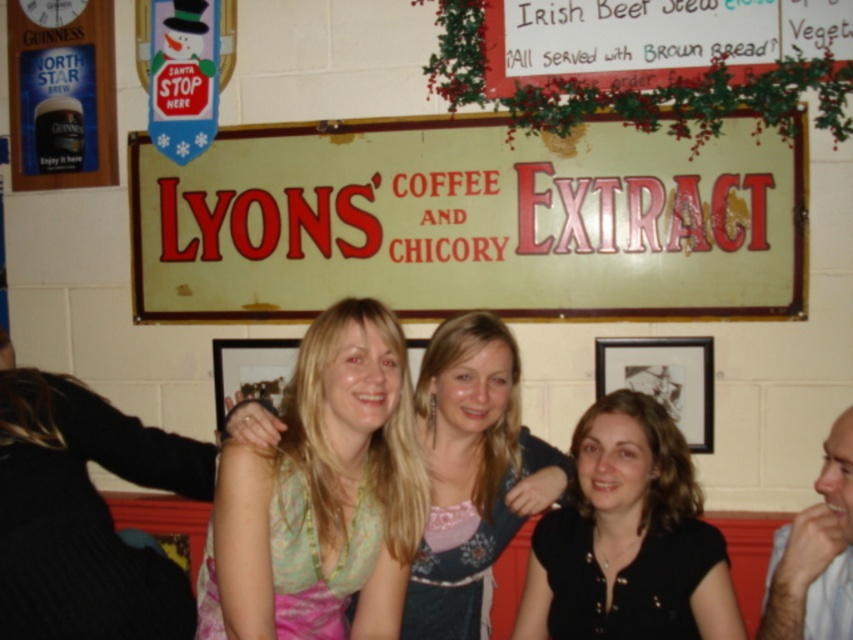
Does white paper sign at upper center have a lesser width compared to matte blue dress at center?

In fact, white paper sign at upper center might be wider than matte blue dress at center.

Is white paper sign at upper center below matte blue dress at center?

Incorrect, white paper sign at upper center is not positioned below matte blue dress at center.

Where is `white paper sign at upper center`? Image resolution: width=853 pixels, height=640 pixels. white paper sign at upper center is located at coordinates (x=468, y=221).

At what (x,y) coordinates should I click in order to perform the action: click on white paper sign at upper center. Please return your answer as a coordinate pair (x, y). The width and height of the screenshot is (853, 640). Looking at the image, I should click on (468, 221).

Between pastel floral dress at center and black matte shirt at center, which one appears on the left side from the viewer's perspective?

pastel floral dress at center

Does pastel floral dress at center come in front of black matte shirt at center?

Yes, it is in front of black matte shirt at center.

You are a GUI agent. You are given a task and a screenshot of the screen. Output one action in this format:
    pyautogui.click(x=<x>, y=<y>)
    Task: Click on the pastel floral dress at center
    
    Given the screenshot: What is the action you would take?
    pyautogui.click(x=322, y=496)

Is black matte shirt at center to the left of matte blue dress at center from the viewer's perspective?

In fact, black matte shirt at center is to the right of matte blue dress at center.

Is black matte shirt at center thinner than matte blue dress at center?

In fact, black matte shirt at center might be wider than matte blue dress at center.

The width and height of the screenshot is (853, 640). What are the coordinates of `black matte shirt at center` in the screenshot? It's located at 628,538.